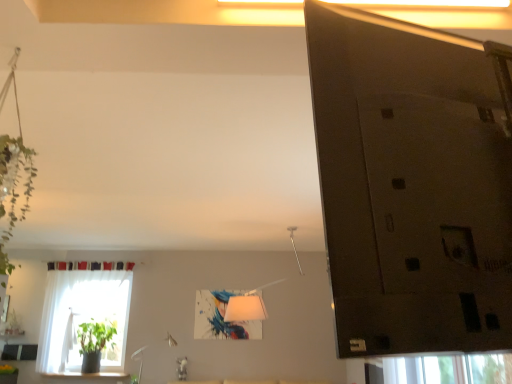
Question: Is green matte plant at lower left taller or shorter than white sheer curtain at left?

Choices:
 (A) tall
 (B) short

Answer: (B)

Question: In the image, is green matte plant at lower left positioned in front of or behind white sheer curtain at left?

Choices:
 (A) front
 (B) behind

Answer: (B)

Question: In terms of size, does green matte plant at lower left appear bigger or smaller than white sheer curtain at left?

Choices:
 (A) small
 (B) big

Answer: (A)

Question: Relative to green matte plant at lower left, is white sheer curtain at left in front or behind?

Choices:
 (A) front
 (B) behind

Answer: (A)

Question: Is white sheer curtain at left taller or shorter than green matte plant at lower left?

Choices:
 (A) tall
 (B) short

Answer: (A)

Question: Is white sheer curtain at left to the left or to the right of green matte plant at lower left in the image?

Choices:
 (A) left
 (B) right

Answer: (A)

Question: From a real-world perspective, relative to green matte plant at lower left, is white sheer curtain at left vertically above or below?

Choices:
 (A) below
 (B) above

Answer: (B)